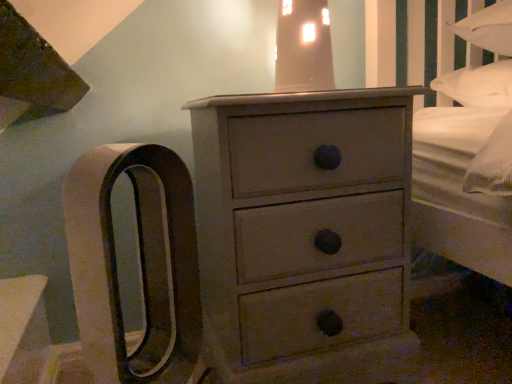
Measure the distance between point [268,95] and camera.

A distance of 31.81 inches exists between point [268,95] and camera.

Image resolution: width=512 pixels, height=384 pixels. I want to click on matte gray chest of drawers at center, so point(305,233).

What do you see at coordinates (305, 233) in the screenshot? This screenshot has height=384, width=512. I see `matte gray chest of drawers at center` at bounding box center [305, 233].

In order to face matte glass lampshade at upper center, should I rotate leftwards or rightwards?

Rotate your view right by about 7.213°.

What do you see at coordinates (303, 47) in the screenshot? The width and height of the screenshot is (512, 384). I see `matte glass lampshade at upper center` at bounding box center [303, 47].

Locate an element on the screen. This screenshot has height=384, width=512. matte glass lampshade at upper center is located at coordinates (303, 47).

This screenshot has width=512, height=384. I want to click on matte gray chest of drawers at center, so click(305, 233).

In the scene shown: Does matte gray chest of drawers at center appear on the right side of matte glass lampshade at upper center?

In fact, matte gray chest of drawers at center is to the left of matte glass lampshade at upper center.

Which object is further away from the camera taking this photo, matte gray chest of drawers at center or matte glass lampshade at upper center?

matte glass lampshade at upper center.

Considering the points (205, 279) and (298, 58), which point is behind, point (205, 279) or point (298, 58)?

The point (205, 279) is farther.

Based on the photo, from the image's perspective, is matte gray chest of drawers at center beneath matte glass lampshade at upper center?

Indeed, from the image's perspective, matte gray chest of drawers at center is shown beneath matte glass lampshade at upper center.

From a real-world perspective, is matte gray chest of drawers at center on matte glass lampshade at upper center?

Incorrect, from a real-world perspective, matte gray chest of drawers at center is lower than matte glass lampshade at upper center.

From the picture: Which object is wider, matte gray chest of drawers at center or matte glass lampshade at upper center?

matte gray chest of drawers at center.

Who is taller, matte gray chest of drawers at center or matte glass lampshade at upper center?

With more height is matte gray chest of drawers at center.

Which of these two, matte gray chest of drawers at center or matte glass lampshade at upper center, is bigger?

matte gray chest of drawers at center.

Could matte glass lampshade at upper center be considered to be inside matte gray chest of drawers at center?

No, matte gray chest of drawers at center does not contain matte glass lampshade at upper center.

Is the surface of matte gray chest of drawers at center in direct contact with matte glass lampshade at upper center?

matte gray chest of drawers at center is not next to matte glass lampshade at upper center, and they're not touching.

Could you tell me if matte gray chest of drawers at center is facing matte glass lampshade at upper center?

No, matte gray chest of drawers at center is not facing towards matte glass lampshade at upper center.

From the picture: Can you tell me how much matte gray chest of drawers at center and matte glass lampshade at upper center differ in facing direction?

The angular difference between matte gray chest of drawers at center and matte glass lampshade at upper center is 0.902 degrees.

Where is `chest of drawers below the matte glass lampshade at upper center (from the image's perspective)`? The image size is (512, 384). chest of drawers below the matte glass lampshade at upper center (from the image's perspective) is located at coordinates (305, 233).

Considering the positions of objects matte glass lampshade at upper center and matte gray chest of drawers at center in the image provided, who is more to the left, matte glass lampshade at upper center or matte gray chest of drawers at center?

matte gray chest of drawers at center is more to the left.

In the image, is matte glass lampshade at upper center positioned in front of or behind matte gray chest of drawers at center?

matte glass lampshade at upper center is positioned farther from the viewer than matte gray chest of drawers at center.

Considering the points (318, 77) and (389, 130), which point is behind, point (318, 77) or point (389, 130)?

The point (318, 77) is farther.

From the image's perspective, between matte glass lampshade at upper center and matte gray chest of drawers at center, who is located below?

From the image's view, matte gray chest of drawers at center is below.

From a real-world perspective, which is physically above, matte glass lampshade at upper center or matte gray chest of drawers at center?

In real-world perspective, matte glass lampshade at upper center is above.

Looking at their sizes, would you say matte glass lampshade at upper center is wider or thinner than matte gray chest of drawers at center?

matte glass lampshade at upper center is thinner than matte gray chest of drawers at center.

Who is shorter, matte glass lampshade at upper center or matte gray chest of drawers at center?

matte glass lampshade at upper center is shorter.

Based on the photo, between matte glass lampshade at upper center and matte gray chest of drawers at center, which one has larger size?

Bigger between the two is matte gray chest of drawers at center.

Do you think matte glass lampshade at upper center is within matte gray chest of drawers at center, or outside of it?

matte glass lampshade at upper center cannot be found inside matte gray chest of drawers at center.

Is matte glass lampshade at upper center positioned far away from matte gray chest of drawers at center?

matte glass lampshade at upper center is near matte gray chest of drawers at center, not far away.

Is matte glass lampshade at upper center turned away from matte gray chest of drawers at center?

No, matte gray chest of drawers at center is not at the back of matte glass lampshade at upper center.

How many degrees apart are the facing directions of matte glass lampshade at upper center and matte gray chest of drawers at center?

0.902 degrees.

Measure the distance between matte glass lampshade at upper center and matte gray chest of drawers at center.

matte glass lampshade at upper center is 12.74 inches from matte gray chest of drawers at center.

Find the location of `the chest of drawers that appears in front of the matte glass lampshade at upper center`. the chest of drawers that appears in front of the matte glass lampshade at upper center is located at coordinates (305, 233).

Where is `bedside lamp that appears above the matte gray chest of drawers at center (from the image's perspective)`? bedside lamp that appears above the matte gray chest of drawers at center (from the image's perspective) is located at coordinates [303, 47].

I want to click on the chest of drawers in front of the matte glass lampshade at upper center, so click(x=305, y=233).